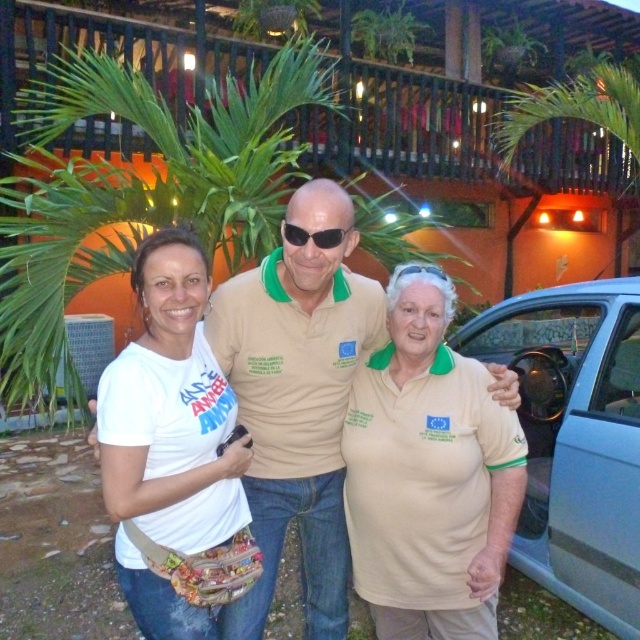
Consider the image. You are a photographer trying to capture a clear shot of both the beige cotton polo shirt at center and the white cotton shirt at left. Which one should you focus on first to ensure it appears sharp in the photo?

You should focus on the beige cotton polo shirt at center first because it is closer to the viewer than the white cotton shirt at left, ensuring it stays sharp while the background may blur slightly.

You are a photographer trying to capture a clear shot of the white fabric shirt at center and the sunglasses at center. Which object is closer to the camera?

The white fabric shirt at center is closer to the camera because it is in front of the sunglasses at center.

What is the position of the white fabric shirt at center in the image?

The white fabric shirt at center is located at point 0.641 on the x axis and 0.269 on the y axis.